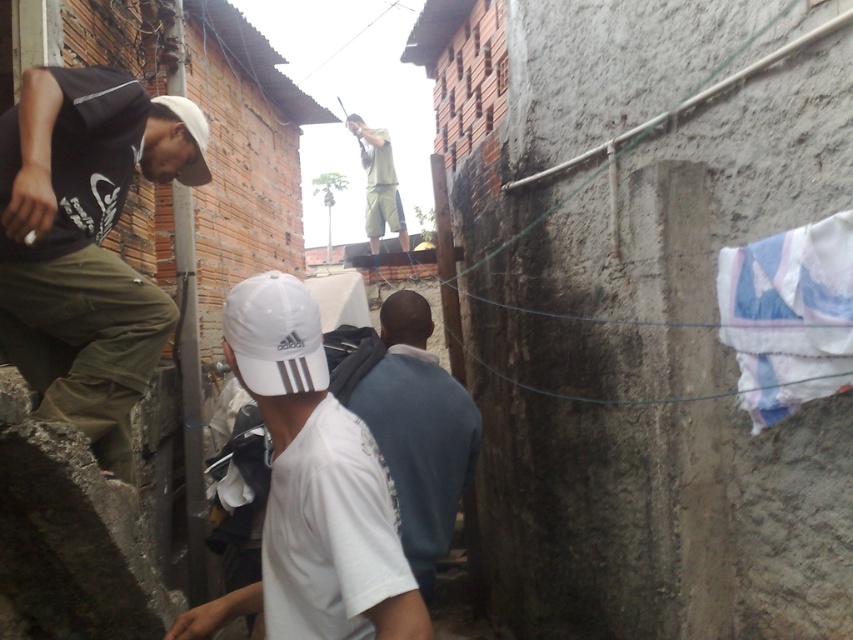
Can you confirm if matte black shirt at left is smaller than blue cotton cloth at right?

No, matte black shirt at left is not smaller than blue cotton cloth at right.

Identify the location of matte black shirt at left. The height and width of the screenshot is (640, 853). (85, 243).

This screenshot has height=640, width=853. I want to click on matte black shirt at left, so coord(85,243).

Between matte black shirt at left and green cotton shorts at upper center, which one has more height?

green cotton shorts at upper center

Is matte black shirt at left below green cotton shorts at upper center?

Yes, matte black shirt at left is below green cotton shorts at upper center.

Describe the element at coordinates (85, 243) in the screenshot. I see `matte black shirt at left` at that location.

Locate an element on the screen. Image resolution: width=853 pixels, height=640 pixels. matte black shirt at left is located at coordinates (85, 243).

Can you confirm if white matte cap at center is thinner than green cotton shorts at upper center?

Correct, white matte cap at center's width is less than green cotton shorts at upper center's.

Is point (287, 438) in front of point (357, 128)?

Yes, point (287, 438) is closer to viewer.

Who is more distant from viewer, (281,324) or (381,196)?

The point (381,196) is more distant.

Locate an element on the screen. Image resolution: width=853 pixels, height=640 pixels. white matte cap at center is located at coordinates (311, 488).